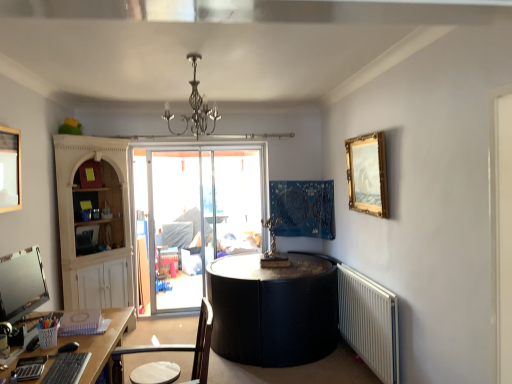
The width and height of the screenshot is (512, 384). Identify the location of free space above white plastic radiator at lower right (from a real-world perspective). (355, 273).